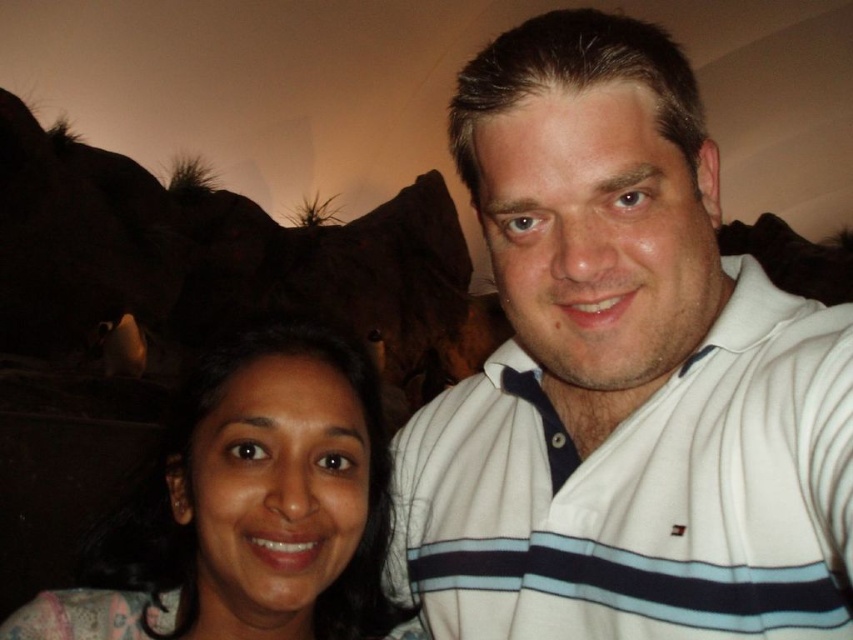
Question: Observing the image, what is the correct spatial positioning of white striped polo shirt at upper right in reference to matte floral dress at lower left?

Choices:
 (A) below
 (B) above

Answer: (B)

Question: Among these objects, which one is farthest from the camera?

Choices:
 (A) matte floral dress at lower left
 (B) white striped polo shirt at upper right

Answer: (A)

Question: Does white striped polo shirt at upper right have a lesser width compared to matte floral dress at lower left?

Choices:
 (A) yes
 (B) no

Answer: (B)

Question: Which point is farther from the camera taking this photo?

Choices:
 (A) (351, 381)
 (B) (683, 572)

Answer: (A)

Question: Does white striped polo shirt at upper right have a greater width compared to matte floral dress at lower left?

Choices:
 (A) yes
 (B) no

Answer: (A)

Question: Which point is closer to the camera taking this photo?

Choices:
 (A) (515, 422)
 (B) (149, 592)

Answer: (B)